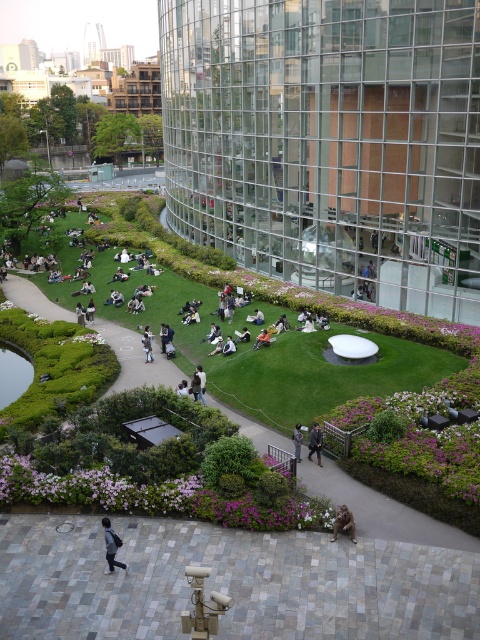
You are a city planner assessing the park layout. The green grassy park at center and dark gray fabric jacket at lower left are both visible in the scene. Which object occupies more horizontal space in the image?

The green grassy park at center occupies more horizontal space than the dark gray fabric jacket at lower left because its width is larger, as stated in the description.